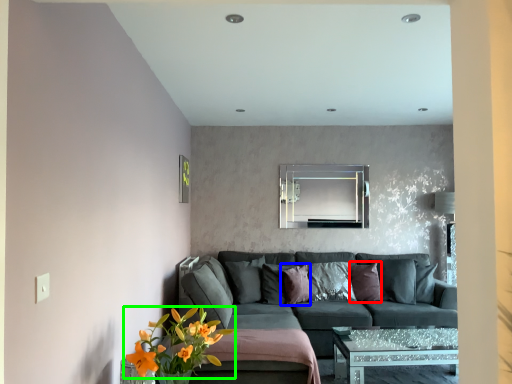
Question: Which object is the closest to the pillow (highlighted by a red box)? Choose among these: pillow (highlighted by a blue box) or flower (highlighted by a green box).

Choices:
 (A) pillow
 (B) flower

Answer: (A)